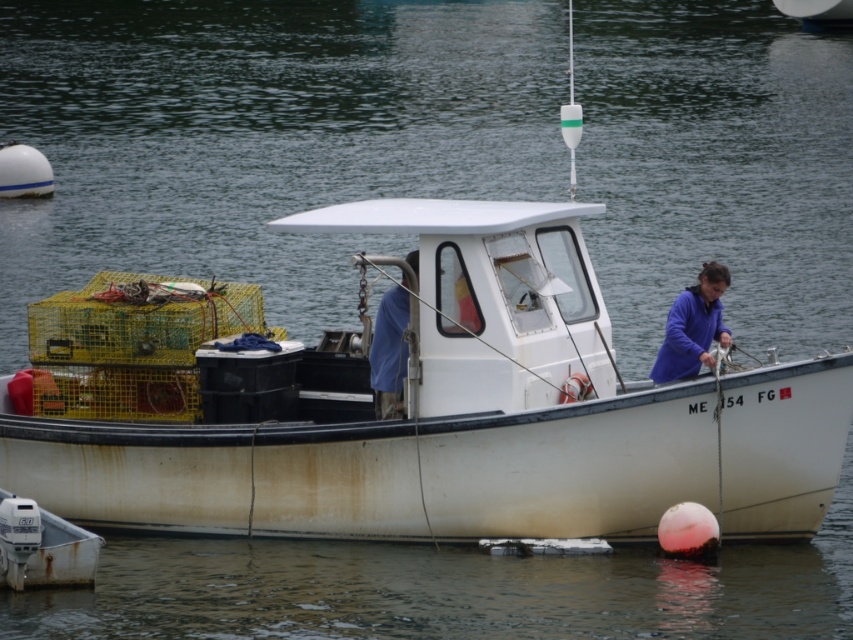
You are a photographer planning to take a photo of the boat and its deck items. You want to ensure both the purple matte jacket at center and the blue fabric at center are visible in the frame. Based on their positions, which item will appear closer to the camera in the photo?

The purple matte jacket at center will appear closer to the camera because the blue fabric at center is positioned behind it.

You are on a fishing boat and see a person wearing a purple matte jacket at center and a blue fabric at center. Which piece of clothing is located to the right when facing the boat?

The purple matte jacket at center is positioned on the right side of the blue fabric at center, so the purple matte jacket at center is located to the right when facing the boat.

You are a photographer trying to capture the details of both the purple matte jacket at center and the blue fabric at center on the boat deck. Which one should you focus on first if you want to ensure the larger object is in sharp focus?

The purple matte jacket at center is larger in size than the blue fabric at center, so you should focus on the purple matte jacket at center first to ensure the larger object is in sharp focus.